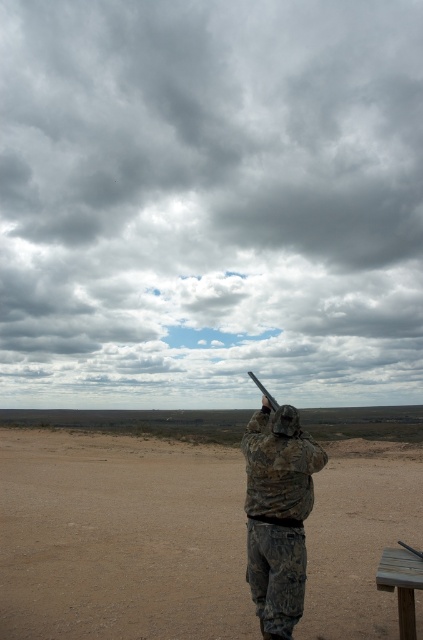
You are a hiker lost in the desert and see the dull brown dirt at center and the matte black shotgun at upper center. Which object is positioned to the left of the other?

The dull brown dirt at center is to the left of the matte black shotgun at upper center.

You are a hiker trying to navigate through the dull brown dirt at center and the matte black shotgun at upper center. Which object is shorter in height?

The dull brown dirt at center is shorter than the matte black shotgun at upper center because it is not as tall as the matte black shotgun at upper center.

You are a soldier in the desert and need to communicate with the camouflage fabric soldier at center. Considering your height is 1.8 meters and the soldier is 1.7 meters tall, can you see their face from your current position 4.33 meters away?

The camouflage fabric soldier at center is 1.7 meters tall. Since you are 1.8 meters tall and positioned 4.33 meters away, you can see their face as the distance allows for clear visibility between you.